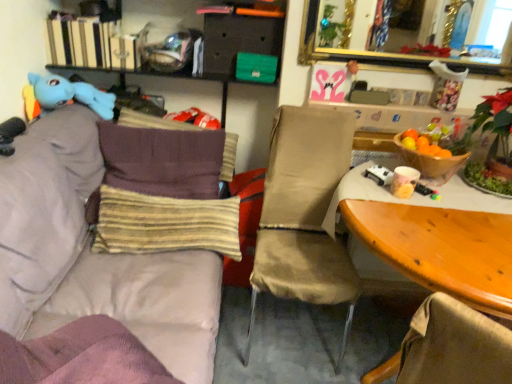
Question: From the image's perspective, is matte black drawer at upper center under beige fabric chair at center?

Choices:
 (A) yes
 (B) no

Answer: (B)

Question: Is matte black drawer at upper center far from beige fabric chair at center?

Choices:
 (A) no
 (B) yes

Answer: (A)

Question: Is matte black drawer at upper center facing towards beige fabric chair at center?

Choices:
 (A) yes
 (B) no

Answer: (B)

Question: Can you confirm if matte black drawer at upper center is shorter than beige fabric chair at center?

Choices:
 (A) yes
 (B) no

Answer: (A)

Question: Is matte black drawer at upper center to the right of beige fabric chair at center from the viewer's perspective?

Choices:
 (A) yes
 (B) no

Answer: (B)

Question: Which is correct: hardcover books at upper left is inside beige fabric chair at center, or outside of it?

Choices:
 (A) outside
 (B) inside

Answer: (A)

Question: Looking at the image, does hardcover books at upper left seem bigger or smaller compared to beige fabric chair at center?

Choices:
 (A) small
 (B) big

Answer: (A)

Question: From the image's perspective, relative to beige fabric chair at center, is hardcover books at upper left above or below?

Choices:
 (A) above
 (B) below

Answer: (A)

Question: Is hardcover books at upper left to the left or to the right of beige fabric chair at center in the image?

Choices:
 (A) right
 (B) left

Answer: (B)

Question: Relative to beige fabric chair at center, is matte black drawer at upper center in front or behind?

Choices:
 (A) behind
 (B) front

Answer: (A)

Question: From a real-world perspective, is matte black drawer at upper center above or below beige fabric chair at center?

Choices:
 (A) above
 (B) below

Answer: (A)

Question: Is matte black drawer at upper center bigger or smaller than beige fabric chair at center?

Choices:
 (A) big
 (B) small

Answer: (B)

Question: Looking at their shapes, would you say matte black drawer at upper center is wider or thinner than beige fabric chair at center?

Choices:
 (A) thin
 (B) wide

Answer: (A)

Question: From the image's perspective, is wooden table at right positioned above or below brown striped pillow at left, which appears as the first pillow when viewed from the back?

Choices:
 (A) below
 (B) above

Answer: (A)

Question: Is wooden table at right inside or outside of brown striped pillow at left, which appears as the first pillow when viewed from the back?

Choices:
 (A) inside
 (B) outside

Answer: (B)